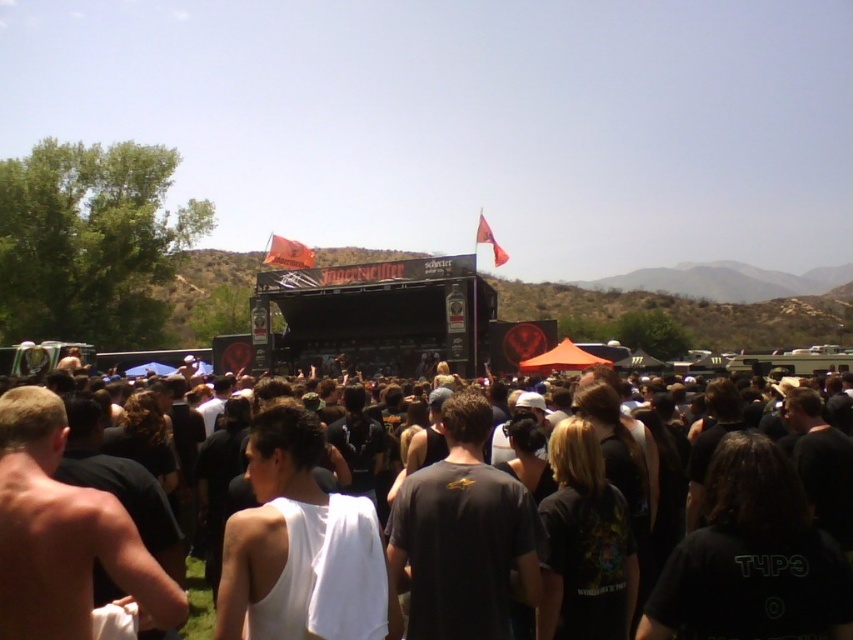
You are a performer standing on the stage at an outdoor concert. You want to interact with the black fabric crowd at center and the shiny skin torso at center. Which of these two groups is closer to you?

The distance between the black fabric crowd at center and the shiny skin torso at center is 10.94 meters. Since you are on the stage, both are in the crowd area, but the question is about proximity. However, the description only provides the distance between them, not their distances from the stage. Thus, the information given doesn

Based on the photo, you are a photographer at the concert. You want to capture a photo that includes both the black fabric crowd at center and the shiny skin torso at center. Which object should you position to the right side of your camera frame to ensure both are visible?

You should position the black fabric crowd at center to the right side of your camera frame since it is already to the right of the shiny skin torso at center. This way, both objects will be included in the photo.